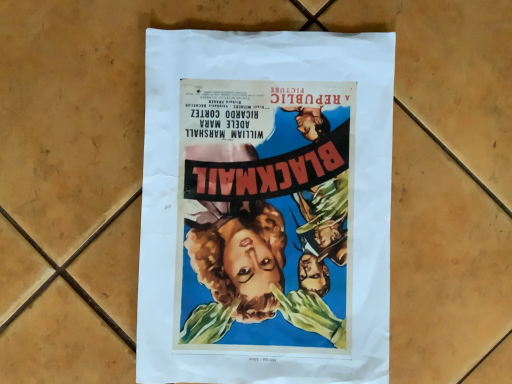
I want to click on free space above matte paper poster at center (from a real-world perspective), so click(271, 205).